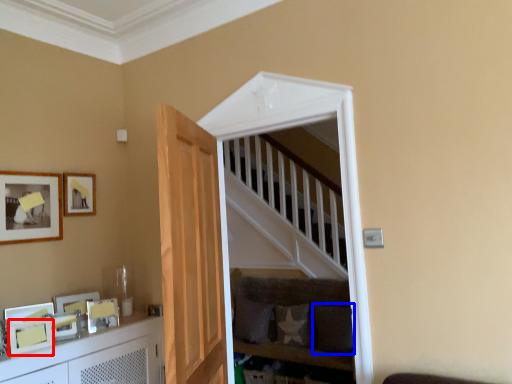
Question: Which object is closer to the camera taking this photo, picture frame (highlighted by a red box) or pillow (highlighted by a blue box)?

Choices:
 (A) picture frame
 (B) pillow

Answer: (A)